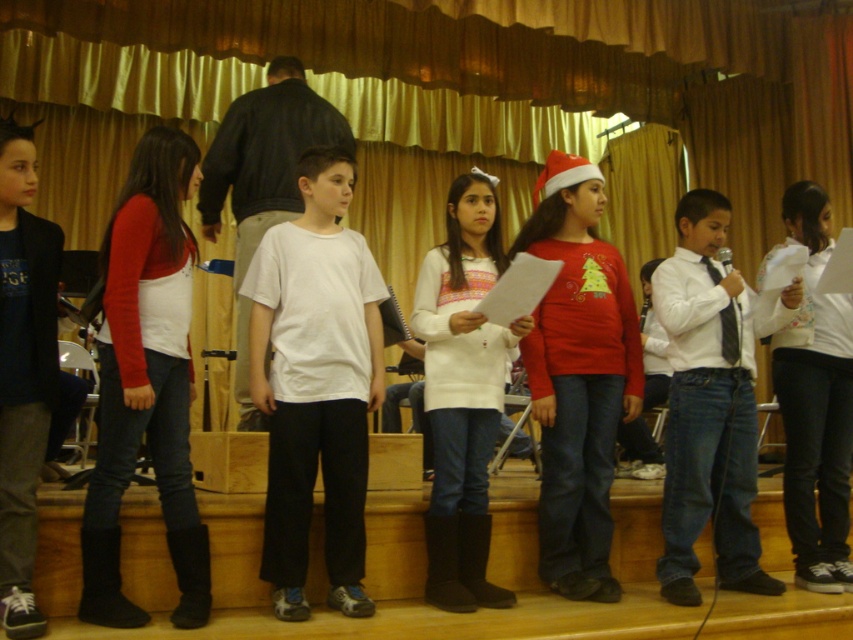
You are a photographer trying to capture a photo of the matte white vest at center and the dark gray pants at center from the audience side. Which one will appear taller in the photo?

The matte white vest at center will appear taller in the photo because it is taller than the dark gray pants at center according to the description.